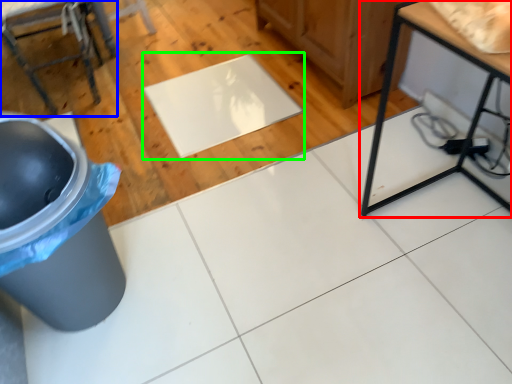
Question: Based on their relative distances, which object is farther from table (highlighted by a red box)? Choose from furniture (highlighted by a blue box) and mat (highlighted by a green box).

Choices:
 (A) furniture
 (B) mat

Answer: (A)